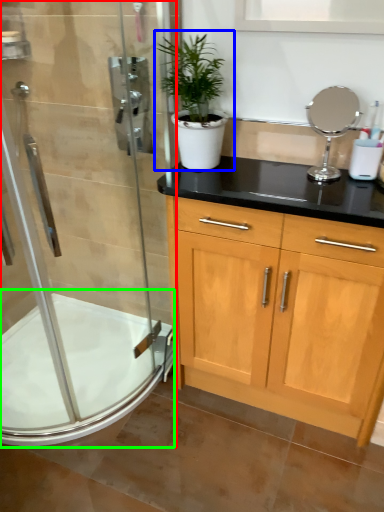
Question: Considering the real-world distances, which object is farthest from shower door (highlighted by a red box)? houseplant (highlighted by a blue box) or bath (highlighted by a green box)?

Choices:
 (A) houseplant
 (B) bath

Answer: (A)